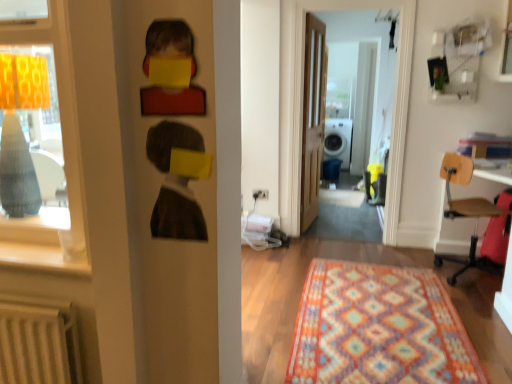
The width and height of the screenshot is (512, 384). What are the coordinates of `free spot above multicolored woven rug at center (from a real-world perspective)` in the screenshot? It's located at [x=364, y=321].